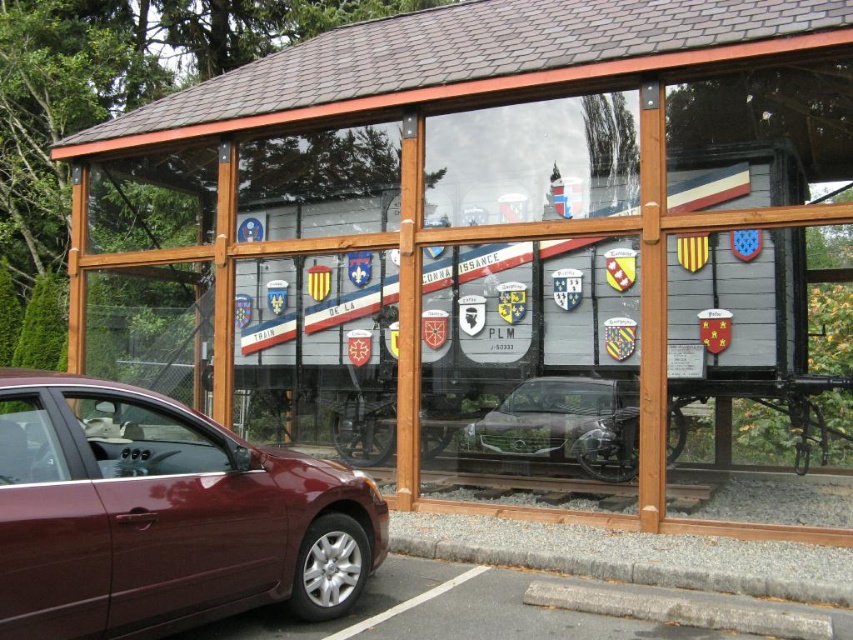
Is point (537, 634) positioned in front of point (601, 472)?

Yes, it is in front of point (601, 472).

Does gray asphalt at lower left come behind satin silver car at center?

No, gray asphalt at lower left is in front of satin silver car at center.

Which is in front, point (631, 627) or point (630, 420)?

Point (631, 627) is in front.

Where is `gray asphalt at lower left`? The height and width of the screenshot is (640, 853). gray asphalt at lower left is located at coordinates point(479,609).

Can you confirm if satin burgundy sedan at lower left is smaller than gray asphalt at lower left?

Actually, satin burgundy sedan at lower left might be larger than gray asphalt at lower left.

Which is more to the left, satin burgundy sedan at lower left or gray asphalt at lower left?

satin burgundy sedan at lower left

Between point (25, 442) and point (508, 577), which one is positioned behind?

Point (508, 577)

Locate an element on the screen. satin burgundy sedan at lower left is located at coordinates (163, 515).

Between satin burgundy sedan at lower left and satin silver car at center, which one is positioned lower?

satin silver car at center is below.

This screenshot has height=640, width=853. I want to click on satin burgundy sedan at lower left, so click(x=163, y=515).

Who is more distant from viewer, (283, 552) or (509, 413)?

The point (509, 413) is more distant.

Where is `satin burgundy sedan at lower left`? The width and height of the screenshot is (853, 640). satin burgundy sedan at lower left is located at coordinates (163, 515).